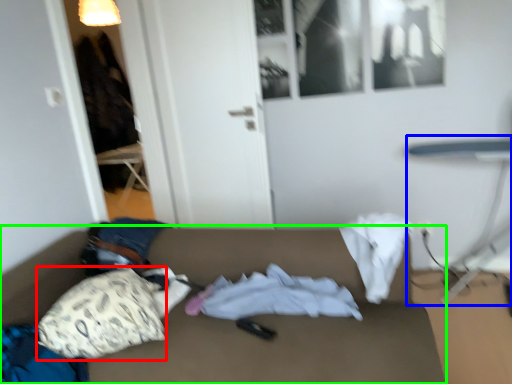
Question: Which object is positioned farthest from throw pillow (highlighted by a red box)? Select from table (highlighted by a blue box) and studio couch (highlighted by a green box).

Choices:
 (A) table
 (B) studio couch

Answer: (A)